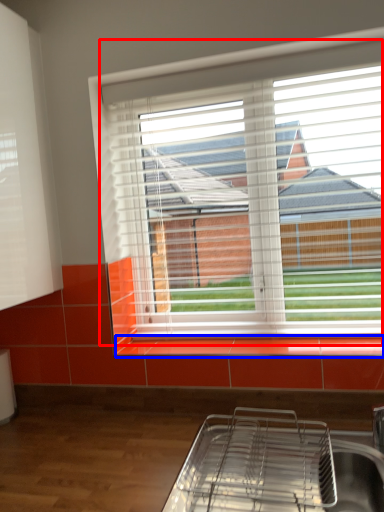
Question: Which object appears farthest to the camera in this image, window (highlighted by a red box) or window sill (highlighted by a blue box)?

Choices:
 (A) window
 (B) window sill

Answer: (A)